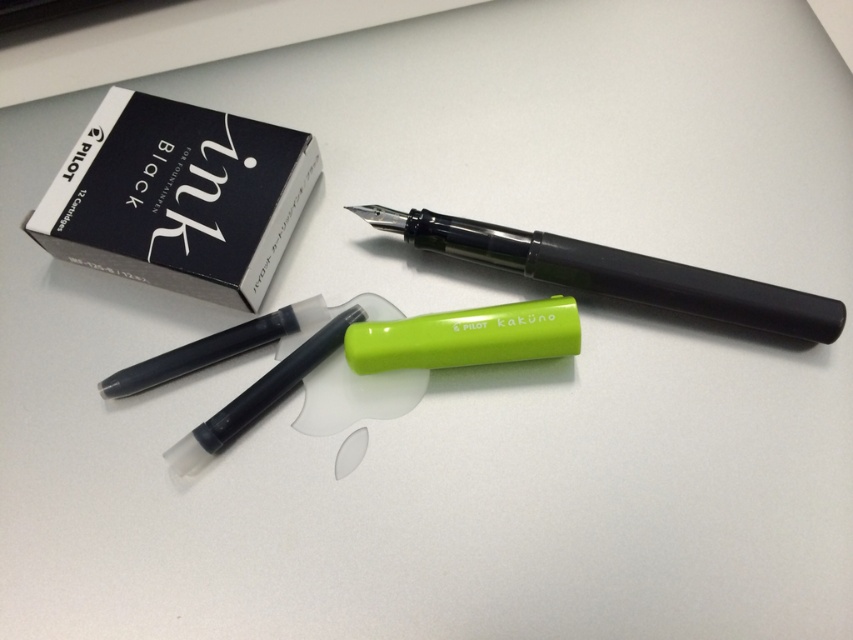
You are organizing a desk and need to place the black matte ink cartridge box at upper left and the white matte eraser at center into a drawer. The drawer has a width of 15 cm. Can you fit both items side by side horizontally?

The black matte ink cartridge box at upper left might be wider than the white matte eraser at center. Since the drawer is 15 cm wide, the combined width of both items could exceed the drawer space. It is uncertain if they will fit without knowing their exact dimensions.

You are organizing a desk and need to stack items vertically. You have the black matte ink cartridge box at upper left and the matte black fountain pen at center. Which item can you place on top of the other without it falling over?

The black matte ink cartridge box at upper left has a greater height compared to the matte black fountain pen at center, so placing the fountain pen on top of the box might be stable. However, since the box is taller, it would be more stable to place the shorter fountain pen on top of the box rather than the other way around to prevent it from tipping over.